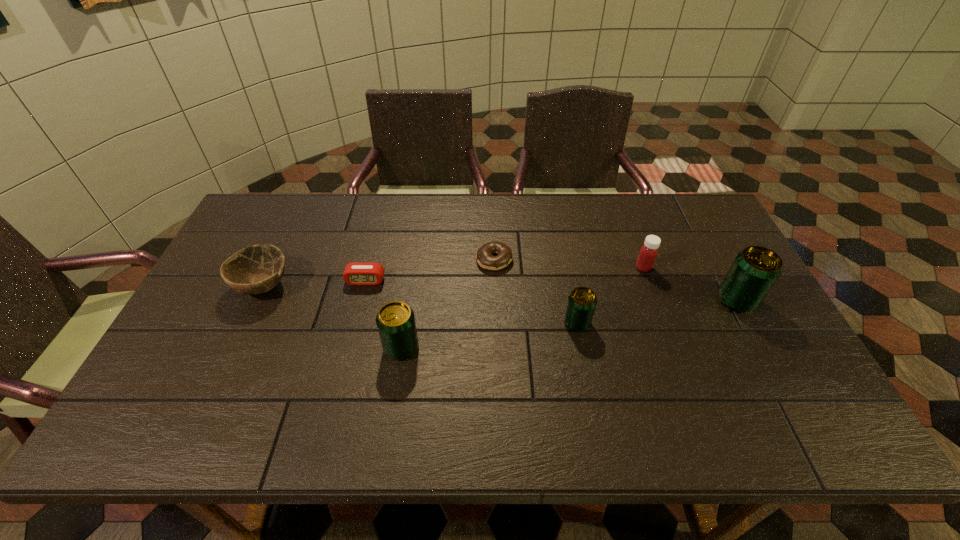
The height and width of the screenshot is (540, 960). I want to click on object that is positioned at the left edge, so click(x=256, y=269).

Find the location of a particular element. The height and width of the screenshot is (540, 960). object present at the right edge is located at coordinates (755, 270).

At what (x,y) coordinates should I click in order to perform the action: click on free space at the far edge of the desktop. Please return your answer as a coordinate pair (x, y). Looking at the image, I should click on (456, 194).

Locate an element on the screen. This screenshot has height=540, width=960. free space at the near edge is located at coordinates (296, 383).

The image size is (960, 540). In the image, there is a desktop. Identify the location of vacant area at the right edge. (706, 253).

Find the location of `free location at the far left corner of the desktop`. free location at the far left corner of the desktop is located at coordinates (290, 214).

I want to click on free space between the sixth tallest object and the fourth object from right to left, so click(x=430, y=270).

Find the location of a particular element. This screenshot has width=960, height=540. empty space that is in between the rightmost object and the sixth object from left to right is located at coordinates (690, 284).

Image resolution: width=960 pixels, height=540 pixels. Find the location of `vacant region between the sixth shortest object and the fifth tallest object`. vacant region between the sixth shortest object and the fifth tallest object is located at coordinates (332, 316).

The image size is (960, 540). Identify the location of vacant space that is in between the leftmost object and the fifth object from right to left. (332, 316).